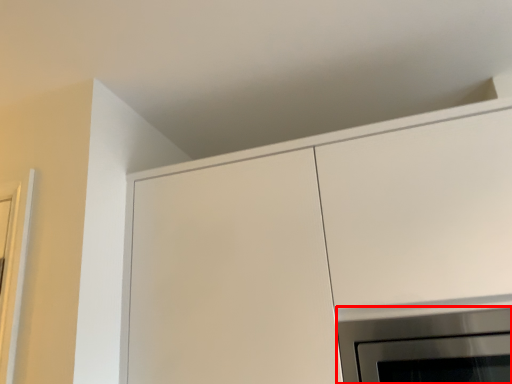
Question: In this image, where is appliance (annotated by the red box) located relative to cabinetry?

Choices:
 (A) left
 (B) right

Answer: (B)